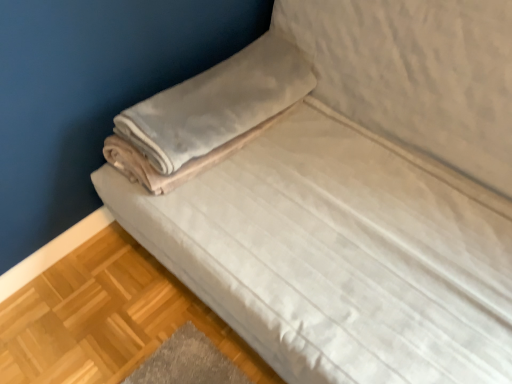
Identify the location of velvet gray pillow at upper left. The height and width of the screenshot is (384, 512). (217, 103).

This screenshot has height=384, width=512. Describe the element at coordinates (217, 103) in the screenshot. I see `velvet gray pillow at upper left` at that location.

You are a GUI agent. You are given a task and a screenshot of the screen. Output one action in this format:
    pyautogui.click(x=<x>, y=<y>)
    Task: Click on the velvet gray pillow at upper left
    This screenshot has height=384, width=512.
    Given the screenshot: What is the action you would take?
    pyautogui.click(x=217, y=103)